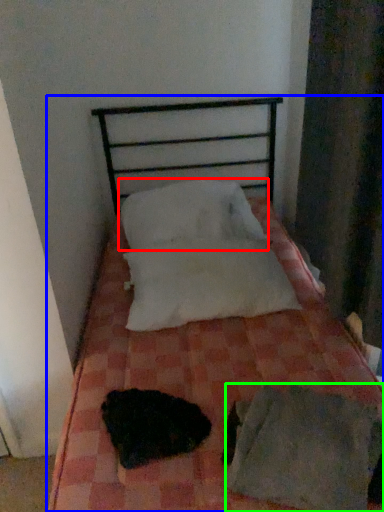
Question: Based on their relative distances, which object is nearer to pillow (highlighted by a red box)? Choose from bed (highlighted by a blue box) and sheet (highlighted by a green box).

Choices:
 (A) bed
 (B) sheet

Answer: (A)